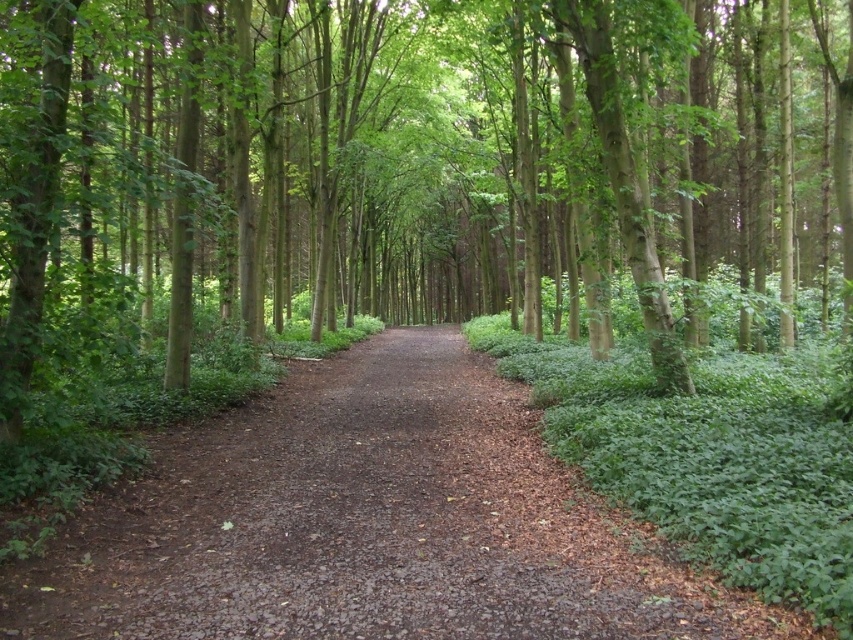
Is point (50, 186) positioned behind point (602, 627)?

Yes, point (50, 186) is farther from viewer.

Between green matte tree at center and brown dirt path at center, which one is positioned lower?

brown dirt path at center is below.

Is point (422, 275) positioned behind point (350, 417)?

Yes, point (422, 275) is behind point (350, 417).

Identify the location of green matte tree at center. The image size is (853, 640). (410, 161).